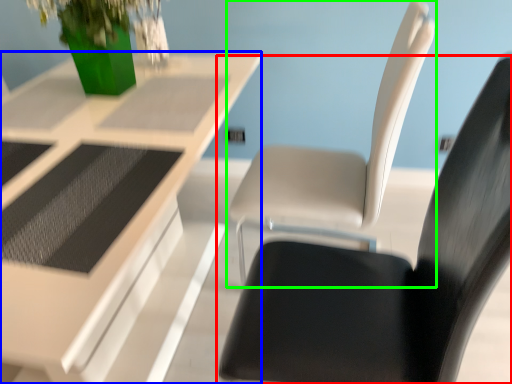
Question: Estimate the real-world distances between objects in this image. Which object is farther from chair (highlighted by a red box), table (highlighted by a blue box) or chair (highlighted by a green box)?

Choices:
 (A) table
 (B) chair

Answer: (A)